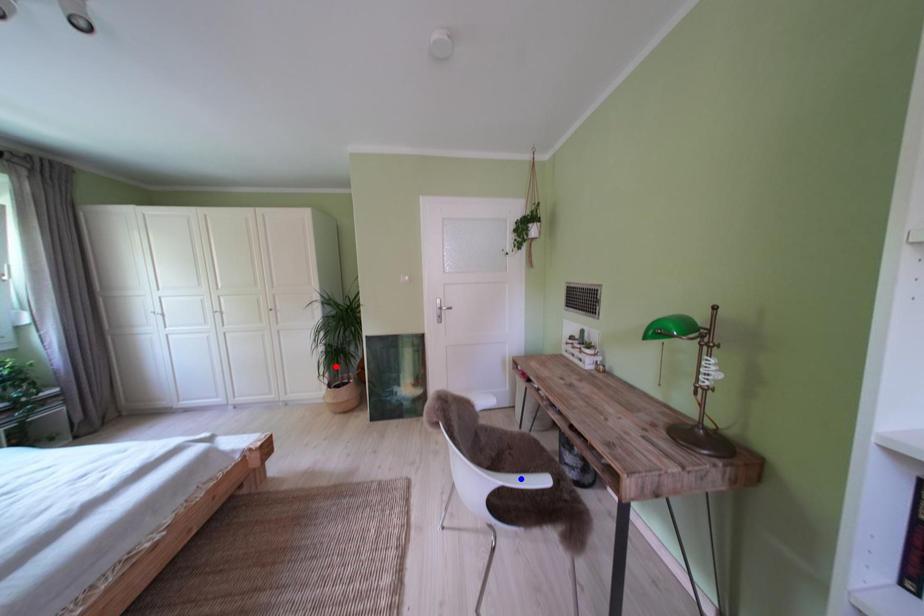
Question: Two points are marked on the image. Which point is closer to the camera?

Choices:
 (A) Blue point is closer.
 (B) Red point is closer.

Answer: (A)